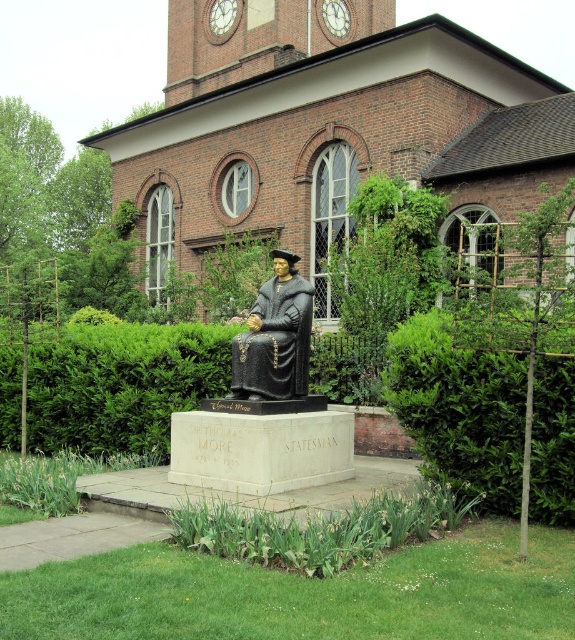
You are an architect designing a new garden layout and need to place a new bench between the brown brick church at center and the bronze statue at center. Which side of the bench should face the wider structure to ensure proper alignment?

The brown brick church at center is wider than the bronze statue at center. Therefore, the bench should be placed so that its wider side faces the brown brick church at center to maintain proper alignment.

You are standing at point [327,125] in the image. What is located at this point?

At point [327,125] lies brown brick church at center.

You are standing at the entrance of the garden and see the statue of Sir Thomas More and the green leafy hedge at center. Which object is closer to you?

The green leafy hedge at center is closer to you because it is located at point (122,384), which is nearer than the statue.